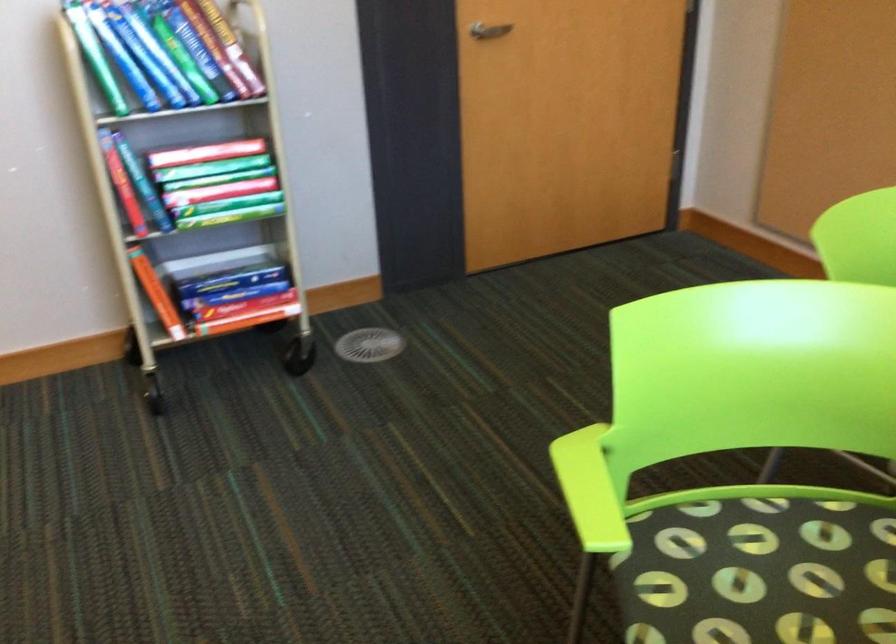
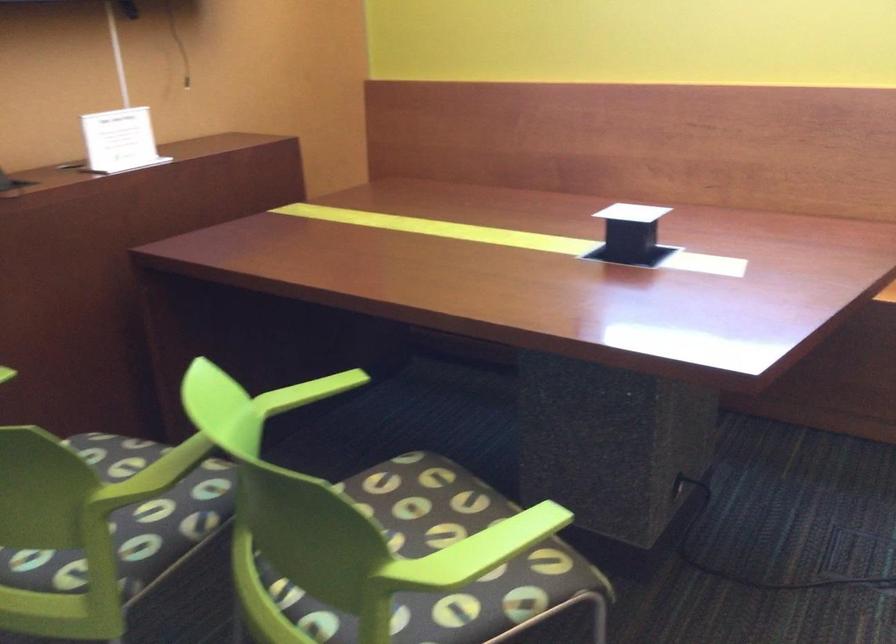
In the second image, find the point that corresponds to pixel 592 476 in the first image.

(476, 552)